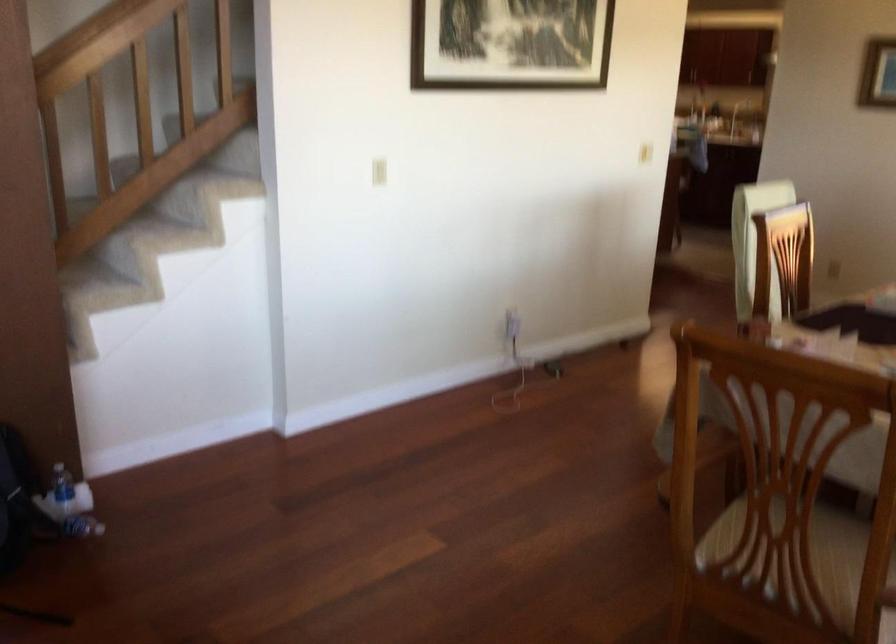
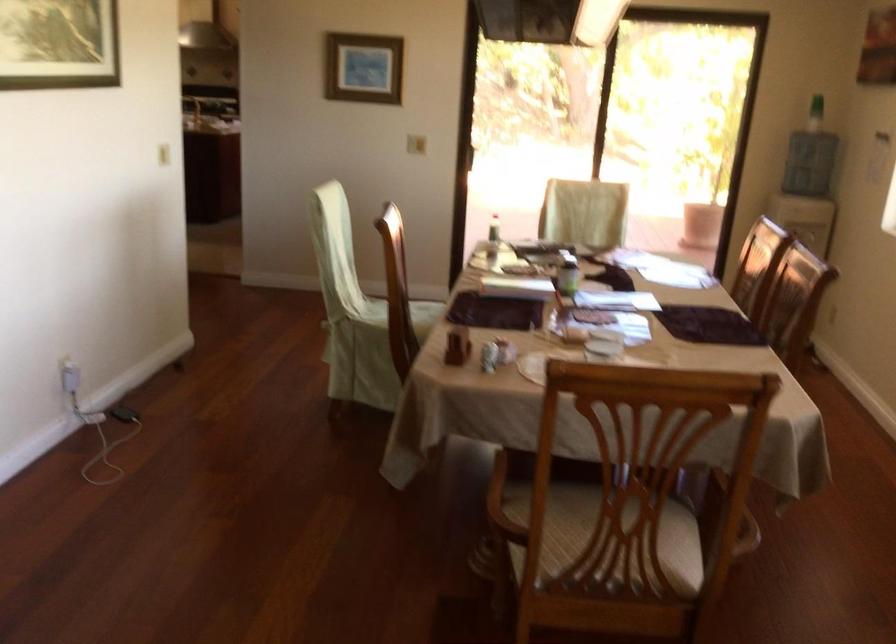
The point at (520, 368) is marked in the first image. Where is the corresponding point in the second image?

(97, 424)